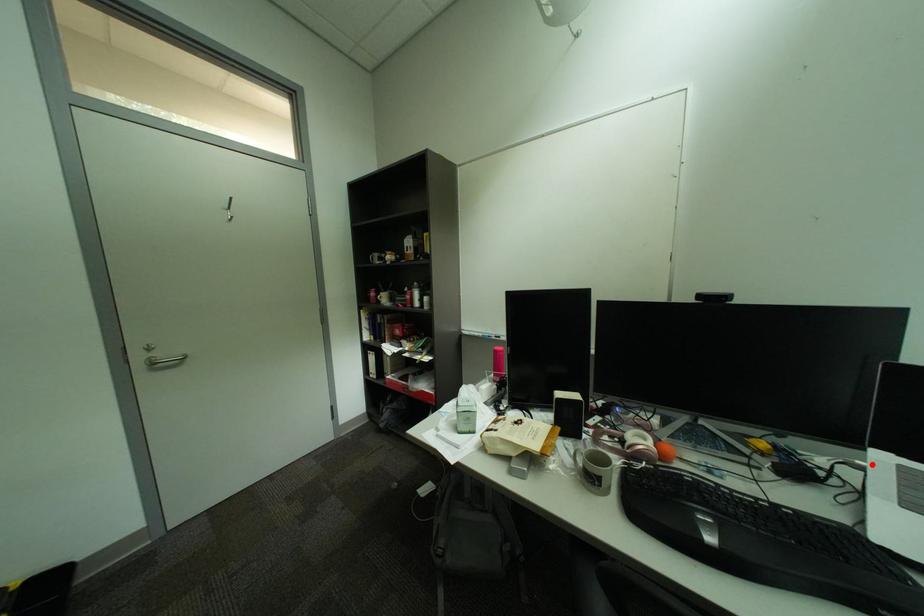
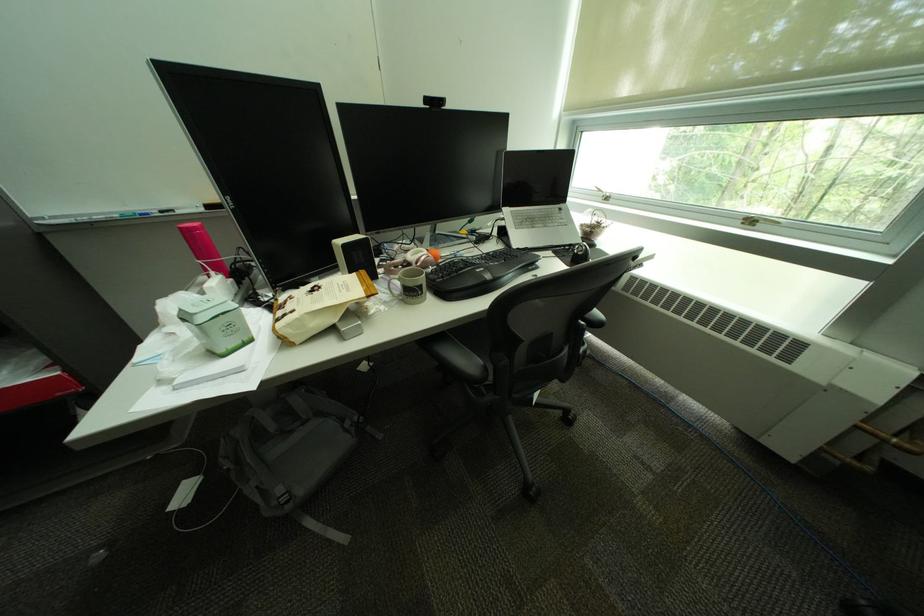
In the second image, find the point that corresponds to the highlighted location in the first image.

(514, 217)